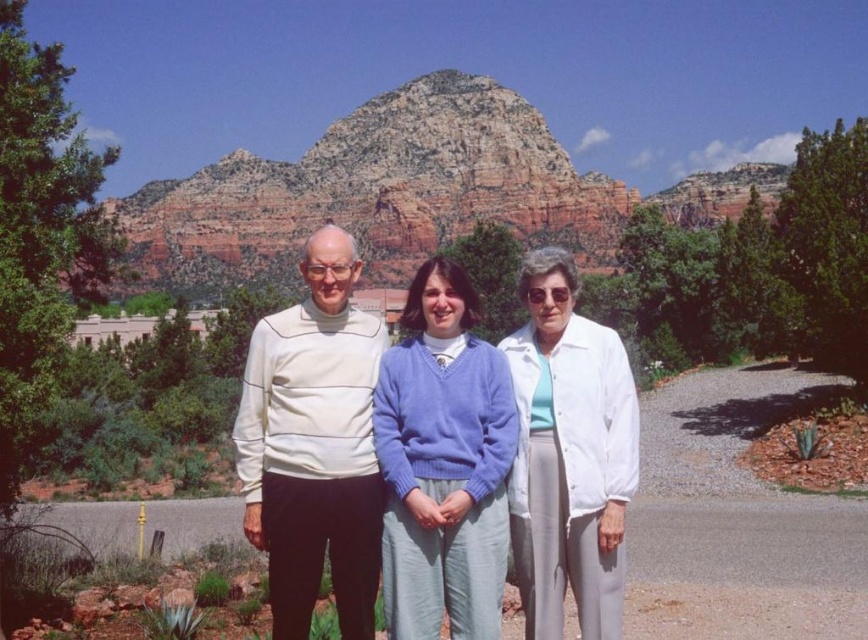
Can you confirm if rustic rock formation at center is positioned to the right of white matte sweater at center?

Indeed, rustic rock formation at center is positioned on the right side of white matte sweater at center.

Which is more to the right, rustic rock formation at center or white matte sweater at center?

rustic rock formation at center is more to the right.

Where is `rustic rock formation at center`? rustic rock formation at center is located at coordinates (402, 193).

Is point (510, 193) positioned after point (415, 401)?

Yes, it is.

The height and width of the screenshot is (640, 868). I want to click on rustic rock formation at center, so click(x=402, y=193).

Does rustic rock formation at center appear over white turtleneck sweater at left?

Correct, rustic rock formation at center is located above white turtleneck sweater at left.

Does rustic rock formation at center come in front of white turtleneck sweater at left?

No, it is behind white turtleneck sweater at left.

Who is more distant from viewer, (297,225) or (308,269)?

The point (297,225) is behind.

Locate an element on the screen. rustic rock formation at center is located at coordinates (402, 193).